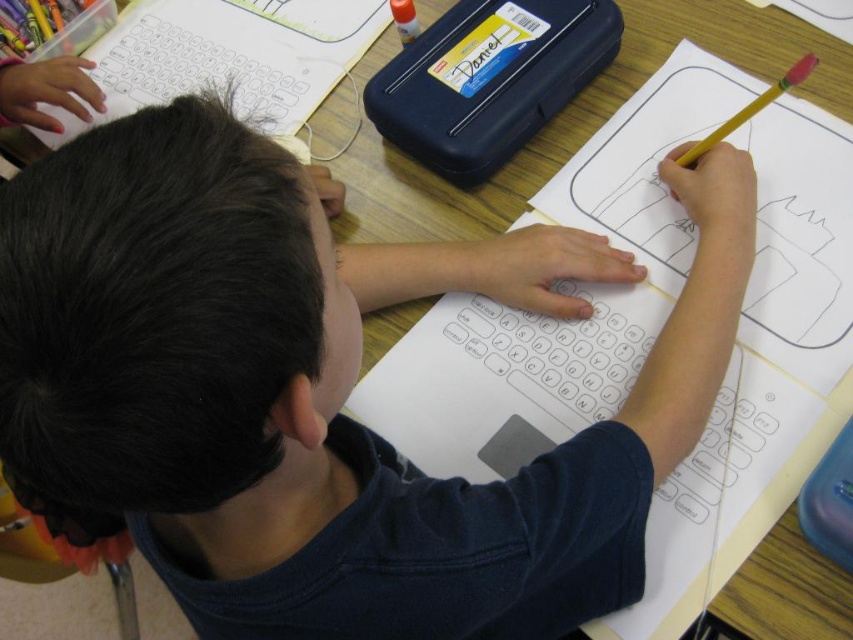
Question: Which point is closer to the camera taking this photo?

Choices:
 (A) (463, 67)
 (B) (699, 140)

Answer: (B)

Question: Can you confirm if yellow plastic nameplate at upper center is bigger than yellow wood pencil at upper right?

Choices:
 (A) no
 (B) yes

Answer: (A)

Question: Which of the following is the farthest from the observer?

Choices:
 (A) (741, 109)
 (B) (496, 38)

Answer: (B)

Question: Does yellow plastic nameplate at upper center appear under yellow wood pencil at upper right?

Choices:
 (A) yes
 (B) no

Answer: (B)

Question: Can you confirm if yellow plastic nameplate at upper center is bigger than yellow wood pencil at upper right?

Choices:
 (A) yes
 (B) no

Answer: (B)